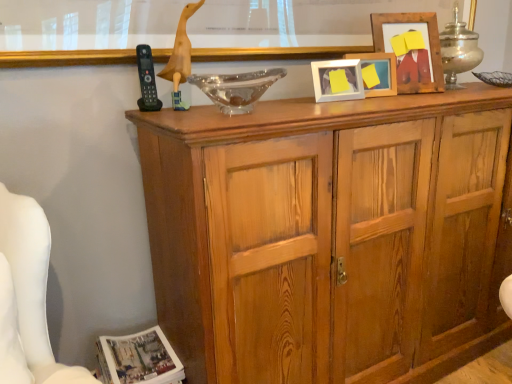
Where is `white glossy magazine at lower left`? This screenshot has height=384, width=512. white glossy magazine at lower left is located at coordinates (139, 359).

This screenshot has width=512, height=384. Describe the element at coordinates (413, 50) in the screenshot. I see `wooden picture frame at upper right, which appears as the 1th picture frame when viewed from the right` at that location.

The width and height of the screenshot is (512, 384). What do you see at coordinates (329, 235) in the screenshot?
I see `wooden cabinet at center` at bounding box center [329, 235].

Find the location of a particular element. This screenshot has height=384, width=512. wooden cabinet at center is located at coordinates (329, 235).

This screenshot has height=384, width=512. Find the location of `wooden duck at upper center`. wooden duck at upper center is located at coordinates (297, 29).

What do you see at coordinates (180, 58) in the screenshot?
I see `wooden duck at upper center` at bounding box center [180, 58].

Locate an element on the screen. Image resolution: width=512 pixels, height=384 pixels. white glossy magazine at lower left is located at coordinates (139, 359).

Could you tell me if white glossy magazine at lower left is turned towards yellow matte picture frame at upper center, which ranks as the 2th picture frame in left-to-right order?

No, white glossy magazine at lower left is not aimed at yellow matte picture frame at upper center, which ranks as the 2th picture frame in left-to-right order.

Measure the distance from white glossy magazine at lower left to yellow matte picture frame at upper center, which ranks as the 2th picture frame in left-to-right order.

white glossy magazine at lower left is 3.81 feet from yellow matte picture frame at upper center, which ranks as the 2th picture frame in left-to-right order.

Is white glossy magazine at lower left far from yellow matte picture frame at upper center, which ranks as the 2th picture frame in left-to-right order?

Yes, white glossy magazine at lower left and yellow matte picture frame at upper center, which ranks as the 2th picture frame in left-to-right order, are quite far apart.

From a real-world perspective, does white glossy magazine at lower left sit lower than yellow matte picture frame at upper center, the second picture frame positioned from the right?

Yes.

Is wooden duck at upper center located outside wooden picture frame at upper right, the 3th picture frame positioned from the left?

wooden duck at upper center is positioned outside wooden picture frame at upper right, the 3th picture frame positioned from the left.

Is wooden duck at upper center smaller than wooden picture frame at upper right, which appears as the 1th picture frame when viewed from the right?

Incorrect, wooden duck at upper center is not smaller in size than wooden picture frame at upper right, which appears as the 1th picture frame when viewed from the right.

Which is behind, wooden duck at upper center or wooden picture frame at upper right, the 3th picture frame positioned from the left?

wooden picture frame at upper right, the 3th picture frame positioned from the left, is further away from the camera.

Where is `bulletin board that is above the white glossy magazine at lower left (from the image's perspective)`? The height and width of the screenshot is (384, 512). bulletin board that is above the white glossy magazine at lower left (from the image's perspective) is located at coordinates pyautogui.click(x=297, y=29).

In the scene shown: Looking at their sizes, would you say white glossy magazine at lower left is wider or thinner than wooden duck at upper center?

Considering their sizes, white glossy magazine at lower left looks broader than wooden duck at upper center.

Is white glossy magazine at lower left inside or outside of wooden duck at upper center?

The correct answer is: outside.

From the image's perspective, would you say white glossy magazine at lower left is shown under wooden duck at upper center?

Yes, from the image's perspective, white glossy magazine at lower left is beneath wooden duck at upper center.

Looking at this image, from a real-world perspective, is wooden cabinet at center under wooden picture frame at upper right, which appears as the 1th picture frame when viewed from the right?

Yes, from a real-world perspective, wooden cabinet at center is beneath wooden picture frame at upper right, which appears as the 1th picture frame when viewed from the right.

How distant is wooden cabinet at center from wooden picture frame at upper right, the 3th picture frame positioned from the left?

22.78 inches.

In the scene shown: Which object is positioned more to the left, wooden cabinet at center or wooden picture frame at upper right, which appears as the 1th picture frame when viewed from the right?

wooden cabinet at center is more to the left.

Image resolution: width=512 pixels, height=384 pixels. Find the location of `cabinetry on the left of wooden picture frame at upper right, the 3th picture frame positioned from the left`. cabinetry on the left of wooden picture frame at upper right, the 3th picture frame positioned from the left is located at coordinates (329, 235).

Is yellow matte picture frame at upper center, the second picture frame positioned from the right, taller or shorter than white matte picture frame at upper center, the 3th picture frame in the right-to-left sequence?

Considering their sizes, yellow matte picture frame at upper center, the second picture frame positioned from the right, has more height than white matte picture frame at upper center, the 3th picture frame in the right-to-left sequence.

From a real-world perspective, count 1st picture frames upward from the white matte picture frame at upper center, arranged as the 1th picture frame when viewed from the left, and point to it. Please provide its 2D coordinates.

[(377, 73)]

Relative to white matte picture frame at upper center, arranged as the 1th picture frame when viewed from the left, is yellow matte picture frame at upper center, which ranks as the 2th picture frame in left-to-right order, in front or behind?

In the image, yellow matte picture frame at upper center, which ranks as the 2th picture frame in left-to-right order, appears behind white matte picture frame at upper center, arranged as the 1th picture frame when viewed from the left.

Does yellow matte picture frame at upper center, the second picture frame positioned from the right, have a lesser width compared to white matte picture frame at upper center, the 3th picture frame in the right-to-left sequence?

No.

From the image's perspective, is wooden duck at upper center on wooden duck at upper center?

Yes.

Can you tell me how much wooden duck at upper center and wooden duck at upper center differ in facing direction?

0.0044 degrees separate the facing orientations of wooden duck at upper center and wooden duck at upper center.

Which point is more distant from viewer, (10, 48) or (186, 63)?

The point (186, 63) is farther from the camera.

Is wooden duck at upper center further to the viewer compared to wooden duck at upper center?

No.

Where is `cabinetry to the right of white glossy magazine at lower left`? The height and width of the screenshot is (384, 512). cabinetry to the right of white glossy magazine at lower left is located at coordinates (329, 235).

Which object is wider, white glossy magazine at lower left or wooden cabinet at center?

wooden cabinet at center is wider.

Is point (178, 368) less distant than point (249, 126)?

No.

From a real-world perspective, which is physically below, white glossy magazine at lower left or wooden cabinet at center?

white glossy magazine at lower left.

This screenshot has height=384, width=512. In order to click on the 2nd picture frame above the white glossy magazine at lower left (from a real-world perspective) in this screenshot , I will do `click(377, 73)`.

Image resolution: width=512 pixels, height=384 pixels. I want to click on the 1st picture frame below the wooden duck at upper center (from the image's perspective), so click(x=413, y=50).

Estimate the real-world distances between objects in this image. Which object is further from wooden picture frame at upper right, which appears as the 1th picture frame when viewed from the right, white matte picture frame at upper center, arranged as the 1th picture frame when viewed from the left, or yellow matte picture frame at upper center, which ranks as the 2th picture frame in left-to-right order?

white matte picture frame at upper center, arranged as the 1th picture frame when viewed from the left, is further to wooden picture frame at upper right, which appears as the 1th picture frame when viewed from the right.

Considering their positions, is wooden picture frame at upper right, which appears as the 1th picture frame when viewed from the right, positioned closer to white glossy magazine at lower left than wooden duck at upper center?

wooden duck at upper center is closer to white glossy magazine at lower left.

Which object lies nearer to the anchor point white matte picture frame at upper center, arranged as the 1th picture frame when viewed from the left, wooden duck at upper center or wooden duck at upper center?

wooden duck at upper center is positioned closer to the anchor white matte picture frame at upper center, arranged as the 1th picture frame when viewed from the left.

Estimate the real-world distances between objects in this image. Which object is further from white glossy magazine at lower left, wooden duck at upper center or yellow matte picture frame at upper center, the second picture frame positioned from the right?

The object further to white glossy magazine at lower left is yellow matte picture frame at upper center, the second picture frame positioned from the right.

From the picture: Considering their positions, is wooden duck at upper center positioned closer to transparent glass bowl at center than wooden picture frame at upper right, the 3th picture frame positioned from the left?

wooden duck at upper center is closer to transparent glass bowl at center.

Which object lies further to the anchor point wooden duck at upper center, wooden cabinet at center or wooden picture frame at upper right, the 3th picture frame positioned from the left?

wooden cabinet at center lies further to wooden duck at upper center than the other object.

From the image, which object appears to be nearer to transparent glass bowl at center, wooden cabinet at center or white glossy magazine at lower left?

wooden cabinet at center is positioned closer to the anchor transparent glass bowl at center.

Consider the image. Which object lies further to the anchor point wooden picture frame at upper right, the 3th picture frame positioned from the left, white matte picture frame at upper center, arranged as the 1th picture frame when viewed from the left, or wooden duck at upper center?

wooden duck at upper center is positioned further to the anchor wooden picture frame at upper right, the 3th picture frame positioned from the left.

Find the location of a particular element. picture frame between transparent glass bowl at center and yellow matte picture frame at upper center, the second picture frame positioned from the right, from left to right is located at coordinates (337, 80).

This screenshot has height=384, width=512. In order to click on bulletin board between wooden duck at upper center and yellow matte picture frame at upper center, the second picture frame positioned from the right, in the horizontal direction in this screenshot , I will do `click(297, 29)`.

At what (x,y) coordinates should I click in order to perform the action: click on glass bowl that lies between wooden duck at upper center and wooden cabinet at center from top to bottom. Please return your answer as a coordinate pair (x, y). Looking at the image, I should click on (236, 88).

The height and width of the screenshot is (384, 512). I want to click on glass bowl between yellow matte picture frame at upper center, the second picture frame positioned from the right, and wooden cabinet at center from top to bottom, so click(236, 88).